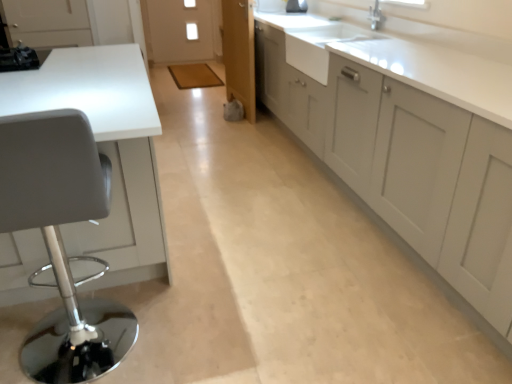
Question: From a real-world perspective, is white glossy countertop at left physically located above or below matte gray cabinets at right?

Choices:
 (A) below
 (B) above

Answer: (A)

Question: Is point (45, 276) positioned closer to the camera than point (364, 66)?

Choices:
 (A) farther
 (B) closer

Answer: (B)

Question: Estimate the real-world distances between objects in this image. Which object is farther from the white glossy countertop at left?

Choices:
 (A) matte gray cabinets at right
 (B) white ceramic sink at upper right

Answer: (B)

Question: Which object is the farthest from the matte gray cabinets at right?

Choices:
 (A) white glossy countertop at left
 (B) white ceramic sink at upper right

Answer: (A)